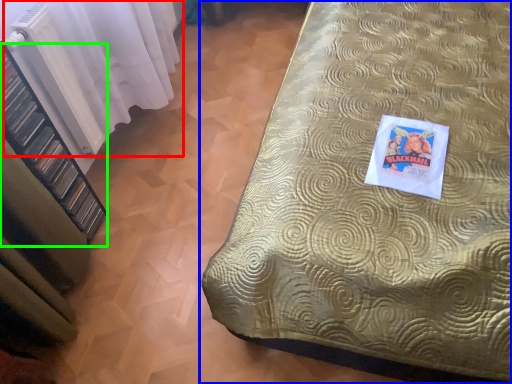
Question: Based on their relative distances, which object is farther from curtain (highlighted by a red box)? Choose from bed (highlighted by a blue box) and shelf (highlighted by a green box).

Choices:
 (A) bed
 (B) shelf

Answer: (A)